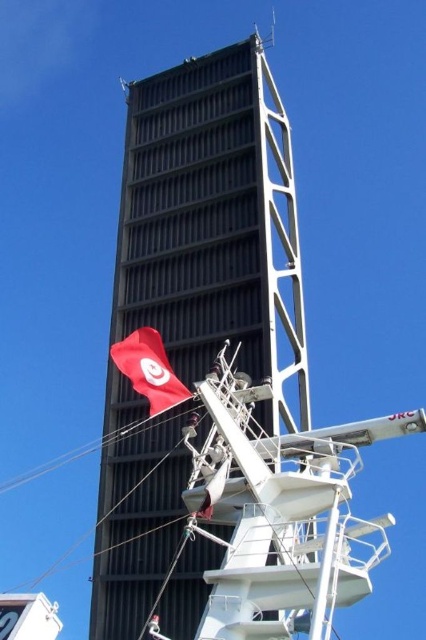
Looking at this image, does black textured panel at center appear under red fabric flag at left?

No, black textured panel at center is not below red fabric flag at left.

Does point (100, 634) come behind point (126, 358)?

Yes, point (100, 634) is behind point (126, 358).

Where is `black textured panel at center`? black textured panel at center is located at coordinates pyautogui.click(x=213, y=225).